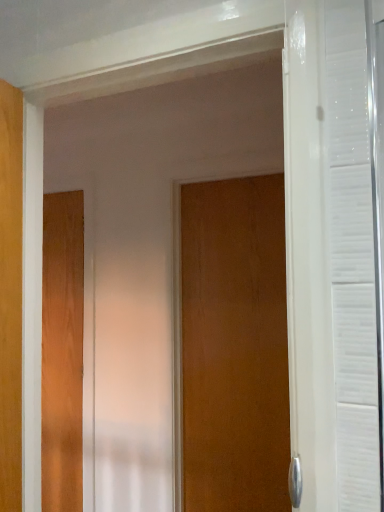
Question: Considering the relative positions of wooden door at center, arranged as the 1th door when viewed from the front, and wooden door at left, the first door viewed from the left, in the image provided, is wooden door at center, arranged as the 1th door when viewed from the front, to the left of wooden door at left, the first door viewed from the left, from the viewer's perspective?

Choices:
 (A) no
 (B) yes

Answer: (A)

Question: Can you confirm if wooden door at center, arranged as the 1th door when viewed from the front, is positioned to the right of wooden door at left, the second door when ordered from right to left?

Choices:
 (A) yes
 (B) no

Answer: (A)

Question: Are wooden door at center, positioned as the second door in left-to-right order, and wooden door at left, the second door when ordered from right to left, located far from each other?

Choices:
 (A) no
 (B) yes

Answer: (A)

Question: Can we say wooden door at center, marked as the 1th door in a right-to-left arrangement, lies outside wooden door at left, acting as the 2th door starting from the front?

Choices:
 (A) yes
 (B) no

Answer: (A)

Question: Is wooden door at center, positioned as the 2th door in back-to-front order, beside wooden door at left, the second door when ordered from right to left?

Choices:
 (A) yes
 (B) no

Answer: (B)

Question: Is wooden door at center, arranged as the 1th door when viewed from the front, facing away from wooden door at left, acting as the 2th door starting from the front?

Choices:
 (A) yes
 (B) no

Answer: (B)

Question: Considering the relative positions of wooden door at left, the first door viewed from the left, and wooden door at center, arranged as the 1th door when viewed from the front, in the image provided, is wooden door at left, the first door viewed from the left, to the left of wooden door at center, arranged as the 1th door when viewed from the front, from the viewer's perspective?

Choices:
 (A) no
 (B) yes

Answer: (B)

Question: From a real-world perspective, does wooden door at left, the second door when ordered from right to left, stand above wooden door at center, marked as the 1th door in a right-to-left arrangement?

Choices:
 (A) yes
 (B) no

Answer: (B)

Question: From the image's perspective, is wooden door at left, which appears as the first door when viewed from the back, located above wooden door at center, positioned as the second door in left-to-right order?

Choices:
 (A) yes
 (B) no

Answer: (B)

Question: Can you confirm if wooden door at left, the second door when ordered from right to left, is wider than wooden door at center, positioned as the second door in left-to-right order?

Choices:
 (A) yes
 (B) no

Answer: (B)

Question: Could you tell me if wooden door at left, which appears as the first door when viewed from the back, is facing wooden door at center, arranged as the 1th door when viewed from the front?

Choices:
 (A) yes
 (B) no

Answer: (B)

Question: From the image's perspective, is wooden door at left, which appears as the first door when viewed from the back, located beneath wooden door at center, marked as the 1th door in a right-to-left arrangement?

Choices:
 (A) no
 (B) yes

Answer: (B)

Question: Looking at their shapes, would you say wooden door at center, positioned as the second door in left-to-right order, is wider or thinner than wooden door at left, which appears as the first door when viewed from the back?

Choices:
 (A) thin
 (B) wide

Answer: (B)